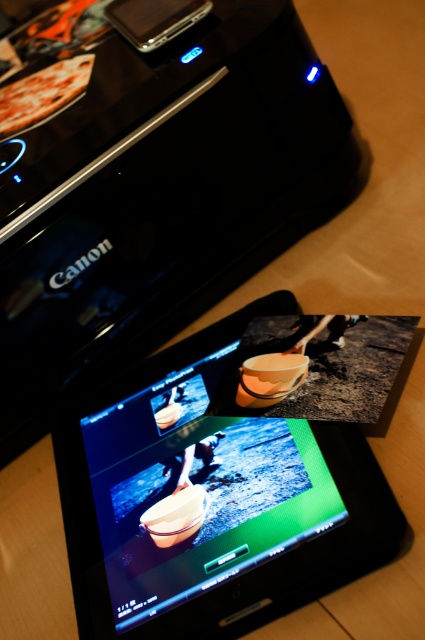
Which is in front, point (130, 579) or point (28, 120)?

Positioned in front is point (130, 579).

Which is more to the right, black glossy tablet at center or golden pizza at upper left?

From the viewer's perspective, black glossy tablet at center appears more on the right side.

Does point (132, 429) come in front of point (61, 74)?

Yes, point (132, 429) is in front of point (61, 74).

You are a GUI agent. You are given a task and a screenshot of the screen. Output one action in this format:
    pyautogui.click(x=<x>, y=<y>)
    Task: Click on the black glossy tablet at center
    The height and width of the screenshot is (640, 425).
    Given the screenshot: What is the action you would take?
    pyautogui.click(x=210, y=499)